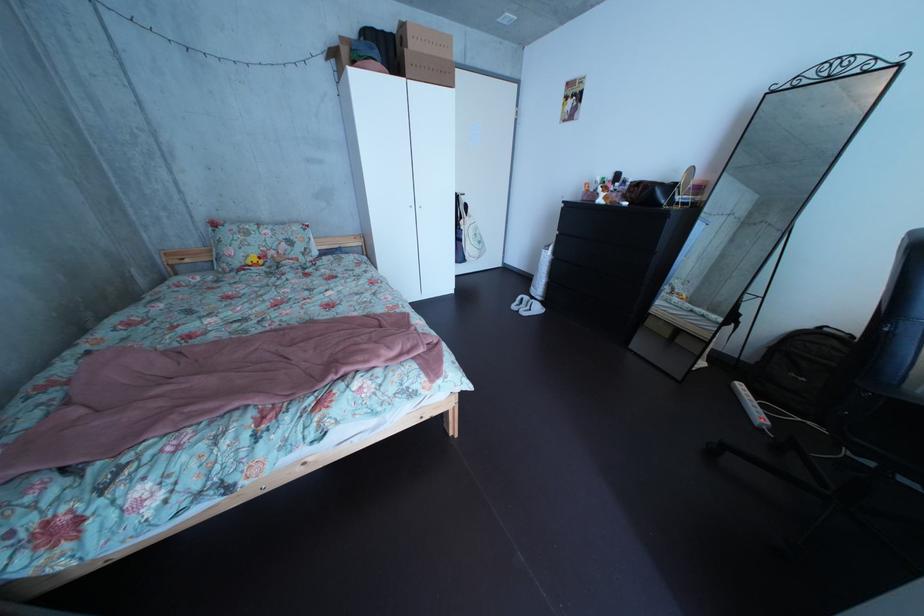
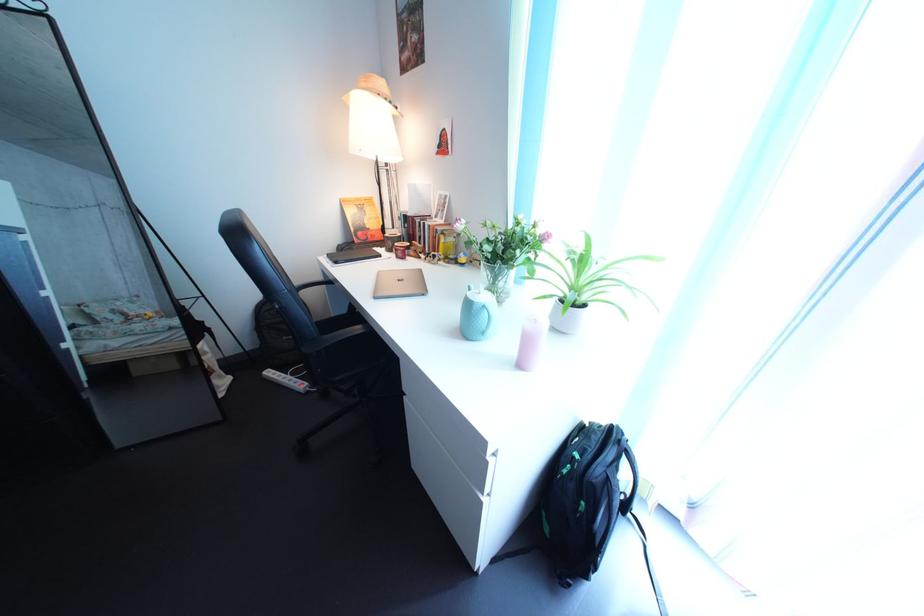
The images are taken continuously from a first-person perspective. In which direction is your viewpoint rotating?

The camera's rotation is toward right-down.